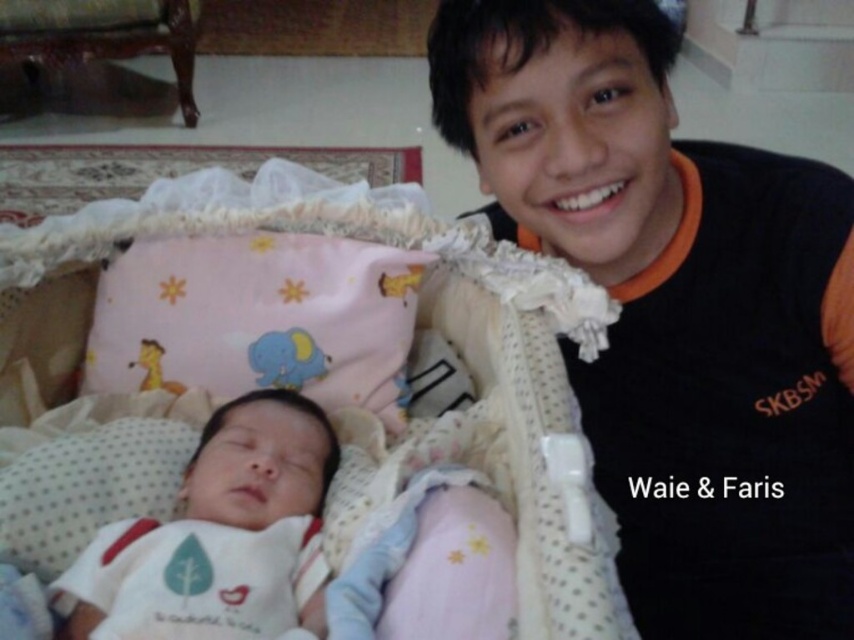
Question: Among these objects, which one is farthest from the camera?

Choices:
 (A) white soft fabric at center
 (B) black cotton shirt at upper right

Answer: (A)

Question: Among these objects, which one is nearest to the camera?

Choices:
 (A) pink fabric infant bed at center
 (B) black cotton shirt at upper right
 (C) white soft fabric at center

Answer: (A)

Question: Is pink fabric infant bed at center above white soft fabric at center?

Choices:
 (A) yes
 (B) no

Answer: (A)

Question: Which point is closer to the camera taking this photo?

Choices:
 (A) (641, 572)
 (B) (516, 381)
 (C) (145, 518)

Answer: (C)

Question: Is black cotton shirt at upper right to the right of pink fabric infant bed at center from the viewer's perspective?

Choices:
 (A) yes
 (B) no

Answer: (A)

Question: Is pink fabric infant bed at center closer to camera compared to white soft fabric at center?

Choices:
 (A) no
 (B) yes

Answer: (B)